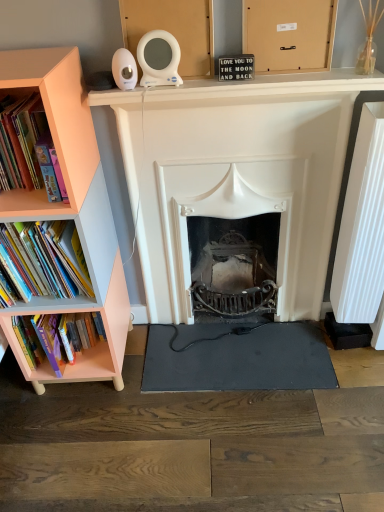
Question: Can you confirm if white matte fireplace at center is thinner than matte cardboard box at upper center?

Choices:
 (A) no
 (B) yes

Answer: (A)

Question: From the image's perspective, is white matte fireplace at center below matte cardboard box at upper center?

Choices:
 (A) no
 (B) yes

Answer: (B)

Question: Can you confirm if white matte fireplace at center is wider than matte cardboard box at upper center?

Choices:
 (A) yes
 (B) no

Answer: (A)

Question: Is white matte fireplace at center to the right of matte cardboard box at upper center from the viewer's perspective?

Choices:
 (A) yes
 (B) no

Answer: (B)

Question: Is white matte fireplace at center located outside matte cardboard box at upper center?

Choices:
 (A) yes
 (B) no

Answer: (A)

Question: Does white matte fireplace at center touch matte cardboard box at upper center?

Choices:
 (A) no
 (B) yes

Answer: (A)

Question: Are pink matte bookshelf at left and peach wood bookcase at left beside each other?

Choices:
 (A) yes
 (B) no

Answer: (B)

Question: From a real-world perspective, is pink matte bookshelf at left physically below peach wood bookcase at left?

Choices:
 (A) yes
 (B) no

Answer: (B)

Question: Is pink matte bookshelf at left positioned with its back to peach wood bookcase at left?

Choices:
 (A) yes
 (B) no

Answer: (A)

Question: Can you confirm if pink matte bookshelf at left is bigger than peach wood bookcase at left?

Choices:
 (A) no
 (B) yes

Answer: (A)

Question: Could you tell me if pink matte bookshelf at left is turned towards peach wood bookcase at left?

Choices:
 (A) yes
 (B) no

Answer: (A)

Question: Is pink matte bookshelf at left further to the viewer compared to peach wood bookcase at left?

Choices:
 (A) yes
 (B) no

Answer: (A)

Question: Is the depth of peach wood bookshelf at left greater than that of peach wood bookcase at left?

Choices:
 (A) no
 (B) yes

Answer: (B)